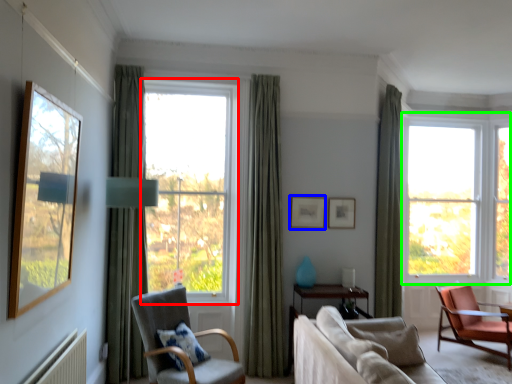
Question: Estimate the real-world distances between objects in this image. Which object is closer to window (highlighted by a red box), picture frame (highlighted by a blue box) or window (highlighted by a green box)?

Choices:
 (A) picture frame
 (B) window

Answer: (A)